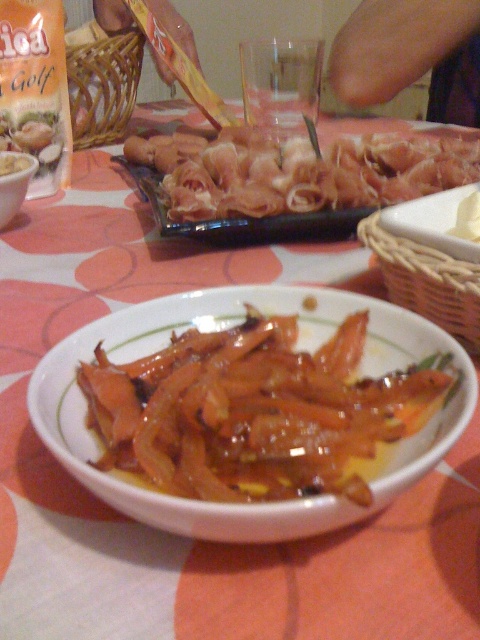
The width and height of the screenshot is (480, 640). Find the location of `pinkish glossy meat at center`. pinkish glossy meat at center is located at coordinates (298, 172).

Who is positioned more to the left, pinkish glossy meat at center or matte white bowl at upper left?

From the viewer's perspective, matte white bowl at upper left appears more on the left side.

Identify the location of pinkish glossy meat at center. This screenshot has height=640, width=480. (298, 172).

Is point (101, 362) farther from viewer compared to point (1, 154)?

No.

Looking at this image, is glossy glazed carrots at center above matte white bowl at upper left?

No.

Does point (192, 445) lie in front of point (31, 161)?

Yes, it is in front of point (31, 161).

Locate an element on the screen. The image size is (480, 640). glossy glazed carrots at center is located at coordinates (254, 412).

Can you confirm if glossy glazed carrots at center is bigger than pinkish glossy meat at center?

Actually, glossy glazed carrots at center might be smaller than pinkish glossy meat at center.

Does glossy glazed carrots at center appear on the left side of pinkish glossy meat at center?

Correct, you'll find glossy glazed carrots at center to the left of pinkish glossy meat at center.

I want to click on glossy glazed carrots at center, so click(254, 412).

In order to click on glossy glazed carrots at center in this screenshot , I will do `click(254, 412)`.